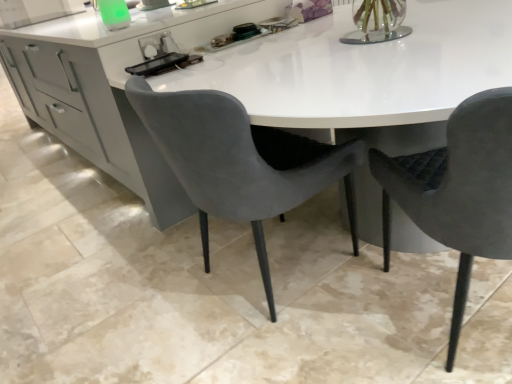
Question: From a real-world perspective, does velvet grey chair at center, the first chair when ordered from left to right, stand above velvet grey chair at right, marked as the second chair in a left-to-right arrangement?

Choices:
 (A) yes
 (B) no

Answer: (A)

Question: Can you confirm if velvet grey chair at center, the first chair when ordered from left to right, is taller than velvet grey chair at right, marked as the second chair in a left-to-right arrangement?

Choices:
 (A) yes
 (B) no

Answer: (B)

Question: Considering the relative positions of velvet grey chair at center, the first chair when ordered from left to right, and velvet grey chair at right, marked as the second chair in a left-to-right arrangement, in the image provided, is velvet grey chair at center, the first chair when ordered from left to right, in front of velvet grey chair at right, marked as the second chair in a left-to-right arrangement,?

Choices:
 (A) yes
 (B) no

Answer: (B)

Question: Can you confirm if velvet grey chair at center, arranged as the 2th chair when viewed from the right, is thinner than velvet grey chair at right, marked as the second chair in a left-to-right arrangement?

Choices:
 (A) yes
 (B) no

Answer: (A)

Question: Is velvet grey chair at right, the first chair from the right, located within velvet grey chair at center, arranged as the 2th chair when viewed from the right?

Choices:
 (A) no
 (B) yes

Answer: (A)

Question: Considering the relative positions of velvet grey chair at center, arranged as the 2th chair when viewed from the right, and velvet grey chair at right, the first chair from the right, in the image provided, is velvet grey chair at center, arranged as the 2th chair when viewed from the right, to the left of velvet grey chair at right, the first chair from the right, from the viewer's perspective?

Choices:
 (A) yes
 (B) no

Answer: (A)

Question: From a real-world perspective, is velvet grey chair at right, the first chair from the right, on top of velvet grey chair at center, the first chair when ordered from left to right?

Choices:
 (A) yes
 (B) no

Answer: (B)

Question: Could velvet grey chair at center, the first chair when ordered from left to right, be considered to be inside velvet grey chair at right, the first chair from the right?

Choices:
 (A) yes
 (B) no

Answer: (B)

Question: Is velvet grey chair at right, marked as the second chair in a left-to-right arrangement, placed right next to velvet grey chair at center, arranged as the 2th chair when viewed from the right?

Choices:
 (A) no
 (B) yes

Answer: (A)

Question: Does velvet grey chair at right, marked as the second chair in a left-to-right arrangement, turn towards velvet grey chair at center, arranged as the 2th chair when viewed from the right?

Choices:
 (A) yes
 (B) no

Answer: (B)

Question: Can we say velvet grey chair at right, marked as the second chair in a left-to-right arrangement, lies outside velvet grey chair at center, arranged as the 2th chair when viewed from the right?

Choices:
 (A) no
 (B) yes

Answer: (B)

Question: Does velvet grey chair at right, the first chair from the right, have a larger size compared to velvet grey chair at center, the first chair when ordered from left to right?

Choices:
 (A) yes
 (B) no

Answer: (B)

Question: From a real-world perspective, relative to velvet grey chair at right, marked as the second chair in a left-to-right arrangement, is velvet grey chair at center, the first chair when ordered from left to right, vertically above or below?

Choices:
 (A) above
 (B) below

Answer: (A)